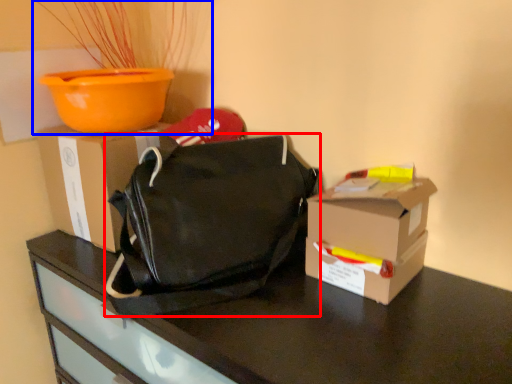
Question: Which object is further to the camera taking this photo, handbag (highlighted by a red box) or houseplant (highlighted by a blue box)?

Choices:
 (A) handbag
 (B) houseplant

Answer: (B)